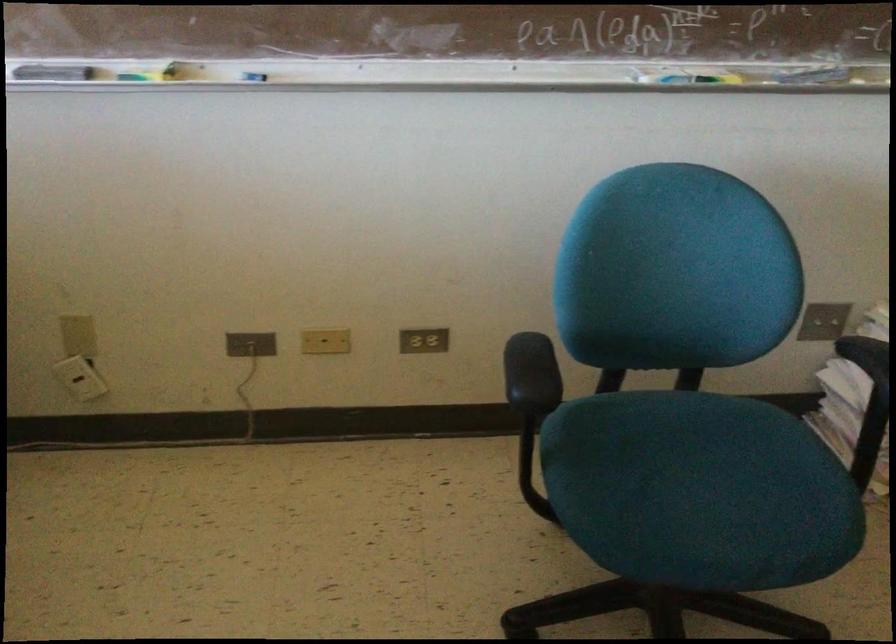
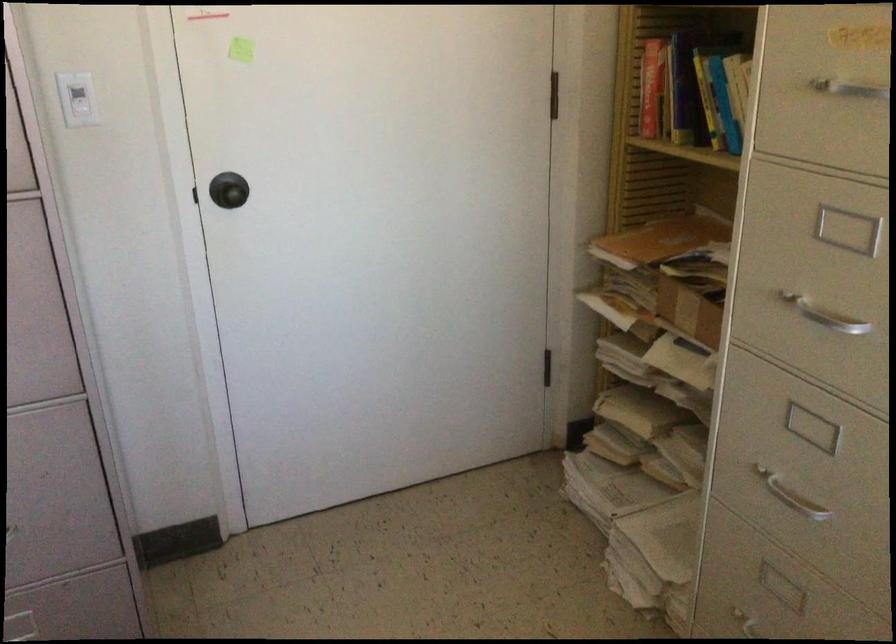
The images are taken continuously from a first-person perspective. In which direction is your viewpoint rotating?

The rotation direction of the camera is right-down.